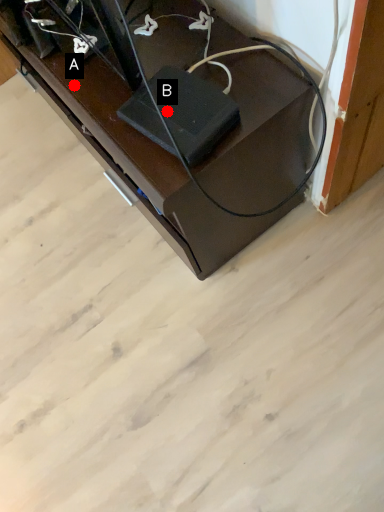
Question: Two points are circled on the image, labeled by A and B beside each circle. Which of the following is the closest to the observer?

Choices:
 (A) A is closer
 (B) B is closer

Answer: (B)